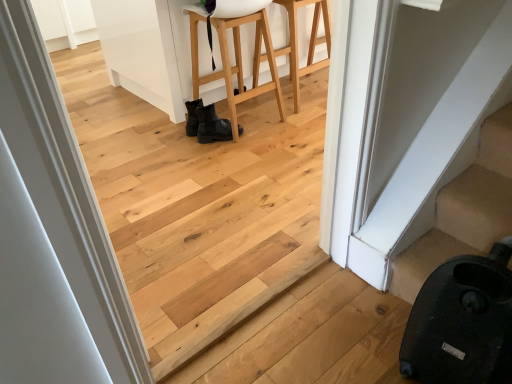
Question: Is black leather boots at center, the 2th furniture viewed from the right, oriented away from natural wood stool at center, acting as the 2th furniture starting from the left?

Choices:
 (A) yes
 (B) no

Answer: (B)

Question: Could natural wood stool at center, the first furniture viewed from the right, be considered to be inside black leather boots at center, the 2th furniture viewed from the right?

Choices:
 (A) no
 (B) yes

Answer: (A)

Question: Is black leather boots at center, the 1th furniture when ordered from left to right, touching natural wood stool at center, acting as the 2th furniture starting from the left?

Choices:
 (A) yes
 (B) no

Answer: (B)

Question: Is black leather boots at center, the 2th furniture viewed from the right, far away from natural wood stool at center, the first furniture viewed from the right?

Choices:
 (A) no
 (B) yes

Answer: (A)

Question: Considering the relative sizes of black leather boots at center, the 1th furniture when ordered from left to right, and natural wood stool at center, the first furniture viewed from the right, in the image provided, is black leather boots at center, the 1th furniture when ordered from left to right, thinner than natural wood stool at center, the first furniture viewed from the right,?

Choices:
 (A) no
 (B) yes

Answer: (A)

Question: From a real-world perspective, is black leather boots at center, the 2th furniture viewed from the right, physically below natural wood stool at center, acting as the 2th furniture starting from the left?

Choices:
 (A) yes
 (B) no

Answer: (B)

Question: Considering the relative positions of black leather boots at center, the 1th furniture when ordered from left to right, and black matte boots at center in the image provided, is black leather boots at center, the 1th furniture when ordered from left to right, to the left of black matte boots at center from the viewer's perspective?

Choices:
 (A) no
 (B) yes

Answer: (A)

Question: Is black leather boots at center, the 1th furniture when ordered from left to right, touching black matte boots at center?

Choices:
 (A) no
 (B) yes

Answer: (A)

Question: Does black leather boots at center, the 2th furniture viewed from the right, have a lesser width compared to black matte boots at center?

Choices:
 (A) yes
 (B) no

Answer: (B)

Question: Considering the relative sizes of black leather boots at center, the 2th furniture viewed from the right, and black matte boots at center in the image provided, is black leather boots at center, the 2th furniture viewed from the right, taller than black matte boots at center?

Choices:
 (A) no
 (B) yes

Answer: (B)

Question: Considering the relative sizes of black leather boots at center, the 2th furniture viewed from the right, and black matte boots at center in the image provided, is black leather boots at center, the 2th furniture viewed from the right, smaller than black matte boots at center?

Choices:
 (A) no
 (B) yes

Answer: (A)

Question: Is black leather boots at center, the 1th furniture when ordered from left to right, in front of black matte boots at center?

Choices:
 (A) no
 (B) yes

Answer: (B)

Question: Does white smooth door at left have a greater height compared to black matte boots at center?

Choices:
 (A) no
 (B) yes

Answer: (B)